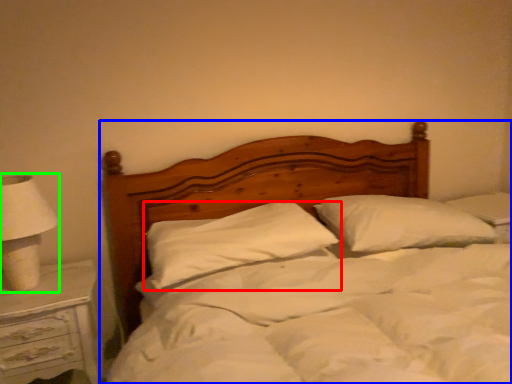
Question: Considering the real-world distances, which object is farthest from pillow (highlighted by a red box)? bed (highlighted by a blue box) or lamp (highlighted by a green box)?

Choices:
 (A) bed
 (B) lamp

Answer: (B)